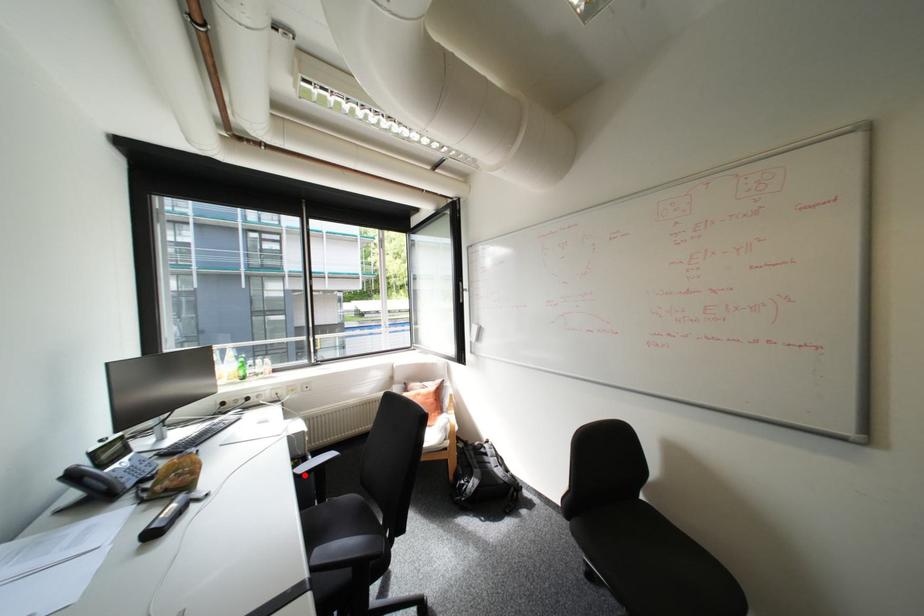
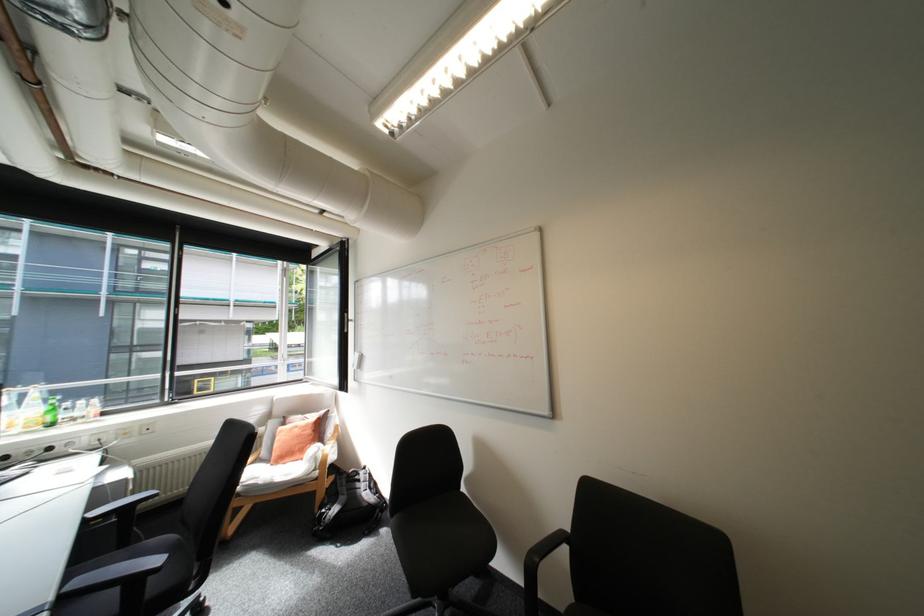
Question: I am providing you with two images of the same scene from different viewpoints. In image1, a red point is highlighted. Considering the same 3D point in image2, which of the following is correct?

Choices:
 (A) It is closer
 (B) It is farther

Answer: (B)